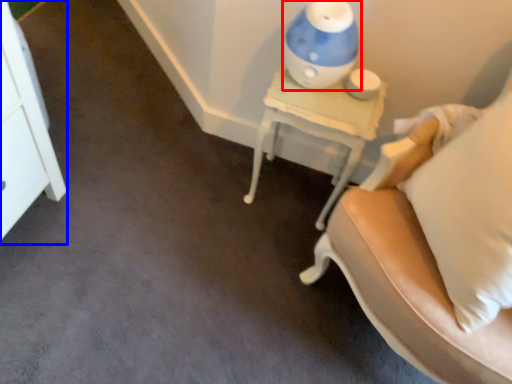
Question: Among these objects, which one is nearest to the camera, table lamp (highlighted by a red box) or dresser (highlighted by a blue box)?

Choices:
 (A) table lamp
 (B) dresser

Answer: (A)